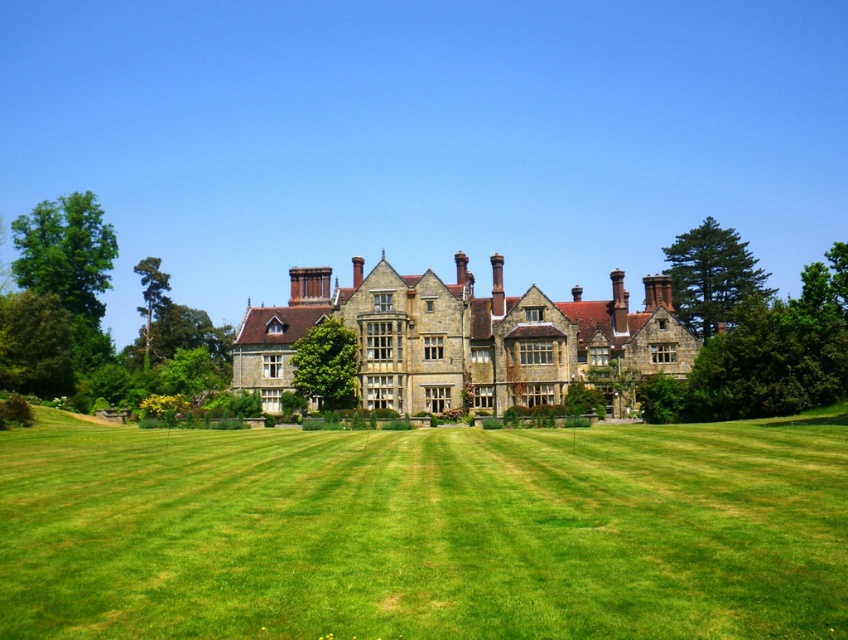
You are standing on the lawn looking towards the mansion. Which object is nearer to you, the green grass at center or the stone brick mansion at center?

The green grass at center is closer to the viewer than the stone brick mansion at center.

You are standing on the lawn in front of the mansion and want to walk to both the point at coordinates (177, 529) and the point at coordinates (646, 278). Which point will you reach first if you start walking towards them from your current position?

You will reach the point at coordinates (177, 529) first because it is closer to you than the point at coordinates (646, 278).